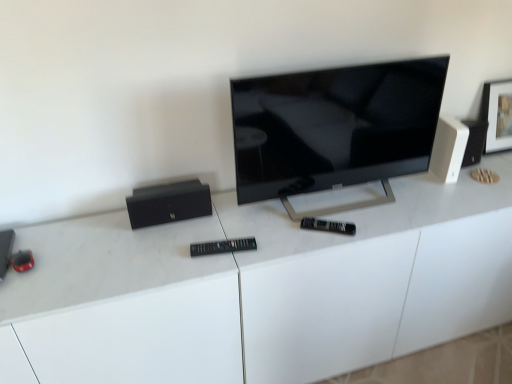
The image size is (512, 384). I want to click on free spot in front of black plastic remote at center, so click(216, 273).